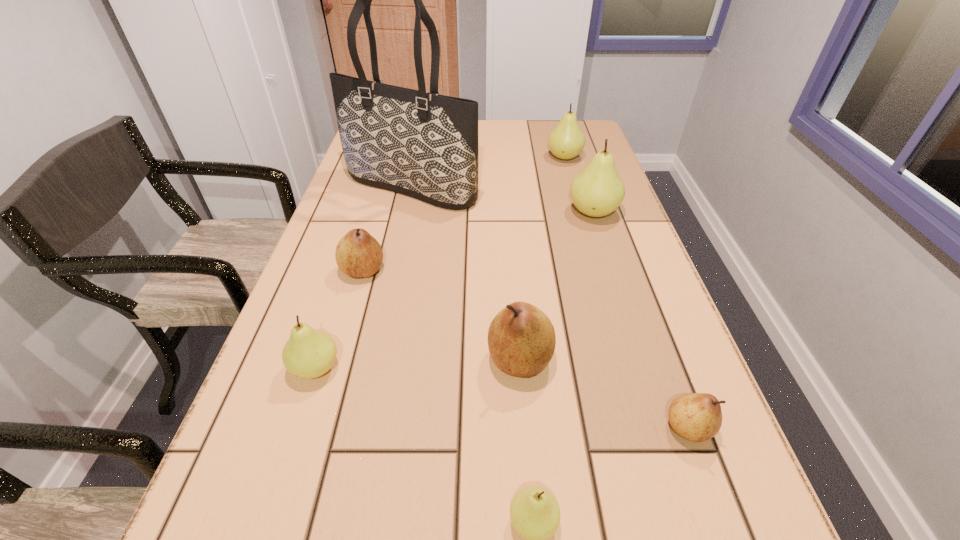
Image resolution: width=960 pixels, height=540 pixels. I want to click on the second biggest brown pear, so click(358, 254).

Identify the location of the third farthest pear. (358, 254).

What are the coordinates of `the smallest brown pear` in the screenshot? It's located at (697, 417).

Identify the location of the nearest brown pear. (697, 417).

The width and height of the screenshot is (960, 540). Find the location of `free location located 0.070m on the back of the black tote bag`. free location located 0.070m on the back of the black tote bag is located at coordinates (418, 156).

Identify the location of vacant space situated on the left of the second farthest green pear. (482, 212).

Where is `free space located 0.120m on the back of the farthest object`? free space located 0.120m on the back of the farthest object is located at coordinates 557,132.

Image resolution: width=960 pixels, height=540 pixels. In order to click on vacant position located 0.330m on the back of the biggest brown pear in this screenshot , I will do `click(510, 229)`.

Identify the location of vacant space located 0.160m on the front of the leftmost green pear. The height and width of the screenshot is (540, 960). (278, 485).

This screenshot has width=960, height=540. What are the coordinates of `free region located 0.150m on the front of the second smallest brown pear` in the screenshot? It's located at (343, 341).